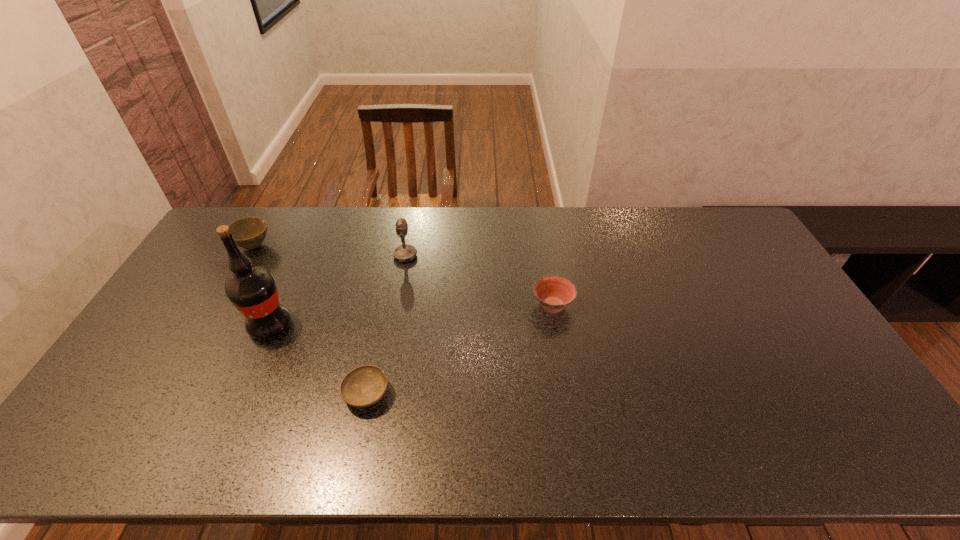
I want to click on wine bottle, so click(252, 290).

Where is `the tallest object`? The image size is (960, 540). the tallest object is located at coordinates (252, 290).

Find the location of a particular element. microphone is located at coordinates (406, 253).

Locate an element on the screen. This screenshot has width=960, height=540. the leftmost bowl is located at coordinates (249, 233).

This screenshot has width=960, height=540. What are the coordinates of `the third tallest object` in the screenshot? It's located at (249, 233).

Image resolution: width=960 pixels, height=540 pixels. I want to click on the second nearest bowl, so click(x=554, y=293).

Find the location of `the second shortest bowl`. the second shortest bowl is located at coordinates (554, 293).

The image size is (960, 540). Identify the location of the nearest object. (365, 385).

Find the location of a particular element. the shortest bowl is located at coordinates (365, 385).

At what (x,y) coordinates should I click in order to perform the action: click on vacant space located 0.130m on the left of the fourth object from right to left. Please return your answer as a coordinate pair (x, y). This screenshot has width=960, height=540. Looking at the image, I should click on (204, 325).